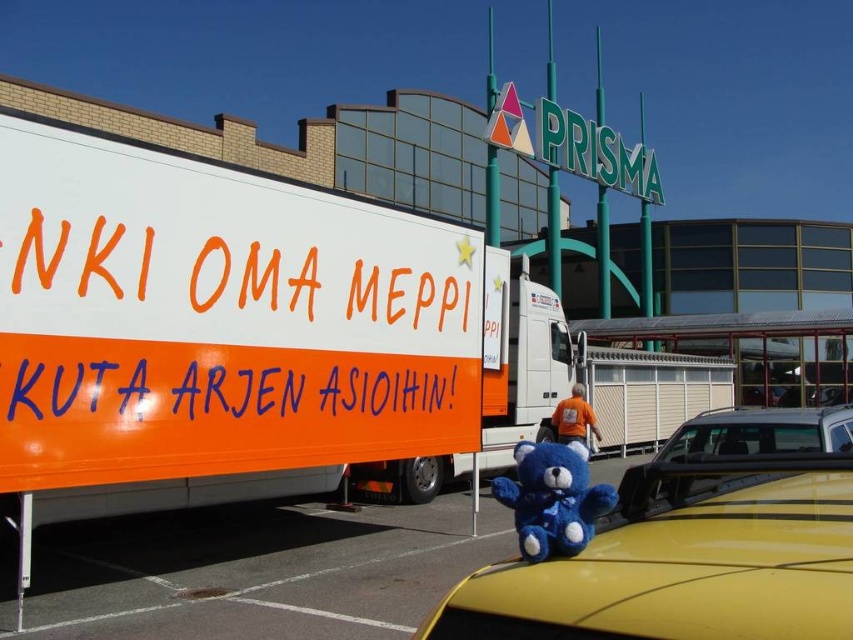
You are a delivery person who needs to park your delivery van between the orange matte trailer truck at left and the blue plush toy at center. Can your van, which is 2 meters wide, fit in the space between them?

The orange matte trailer truck at left is thinner than the blue plush toy at center, but the exact width of the space between them isn not provided. Without knowing the distance between the two objects, it is impossible to determine if the van can fit.

You are standing at the entrance of the Prisma store and want to take a photo of the orange matte trailer truck at left. Where should you position yourself to capture the truck in the frame?

To capture the orange matte trailer truck at left in your photo, position yourself at the entrance of the Prisma store and aim your camera towards the truck located at point (241, 332).

You are standing in front of the Prisma store and see the orange and white truck with the Finnish text. There is a point marked at coordinates (241, 332). What object is located at this point?

The point at coordinates (241, 332) corresponds to the orange matte trailer truck at left.